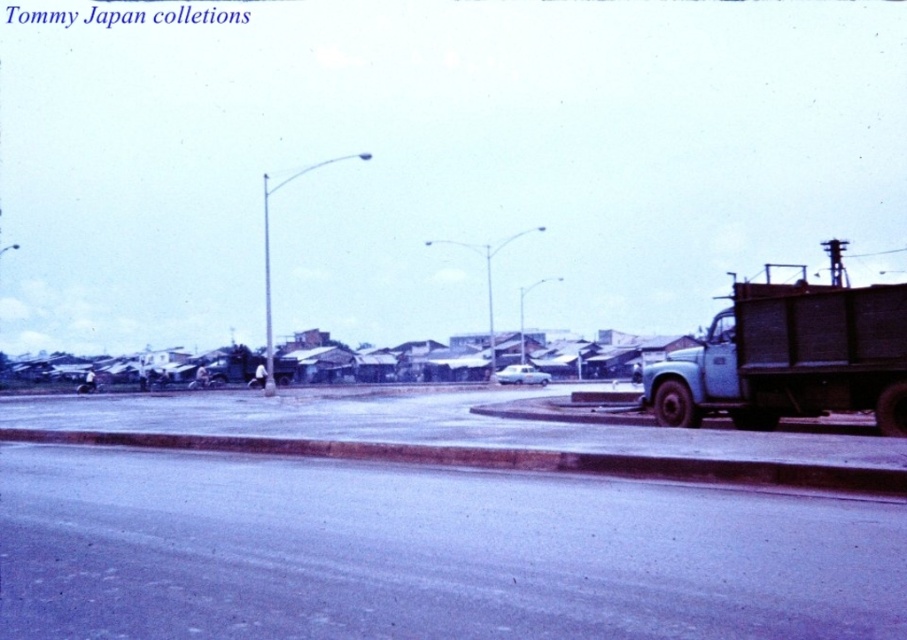
You are a pedestrian standing on the sidewalk and want to cross the street to reach the buildings ahead. There is a smooth concrete curb at lower center and a white glossy car at center. Which object should you avoid stepping on to stay safe?

You should avoid stepping on the smooth concrete curb at lower center because it is positioned to the left of the white glossy car at center, indicating it is part of the road edge where vehicles are parked or moving. Staying on the sidewalk away from the curb and the car ensures safety.